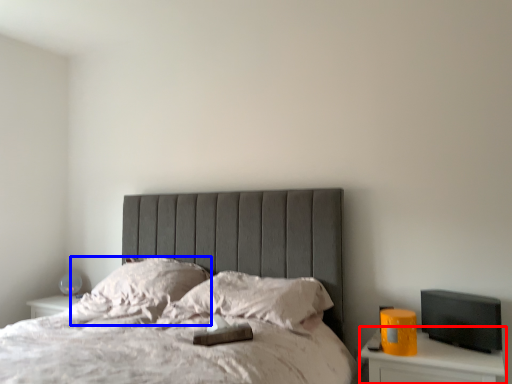
Question: Which object appears closest to the camera in this image, nightstand (highlighted by a red box) or pillow (highlighted by a blue box)?

Choices:
 (A) nightstand
 (B) pillow

Answer: (A)